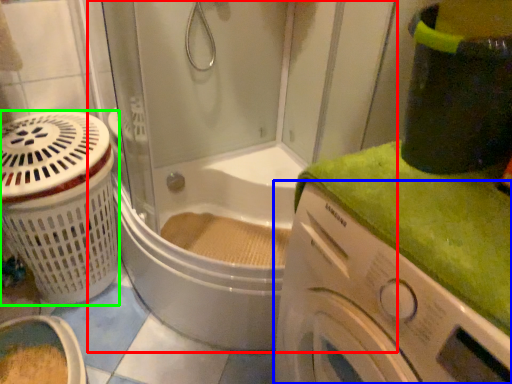
Question: Which object is positioned closest to shower door (highlighted by a red box)? Select from washing machine (highlighted by a blue box) and basket (highlighted by a green box).

Choices:
 (A) washing machine
 (B) basket

Answer: (B)